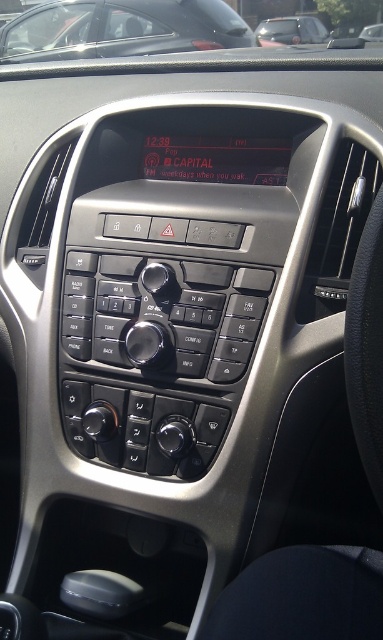
Can you confirm if metallic gray car at upper center is bigger than metallic silver car at upper center?

Correct, metallic gray car at upper center is larger in size than metallic silver car at upper center.

Who is shorter, metallic gray car at upper center or metallic silver car at upper center?

metallic silver car at upper center is shorter.

The width and height of the screenshot is (383, 640). What are the coordinates of `metallic gray car at upper center` in the screenshot? It's located at (121, 28).